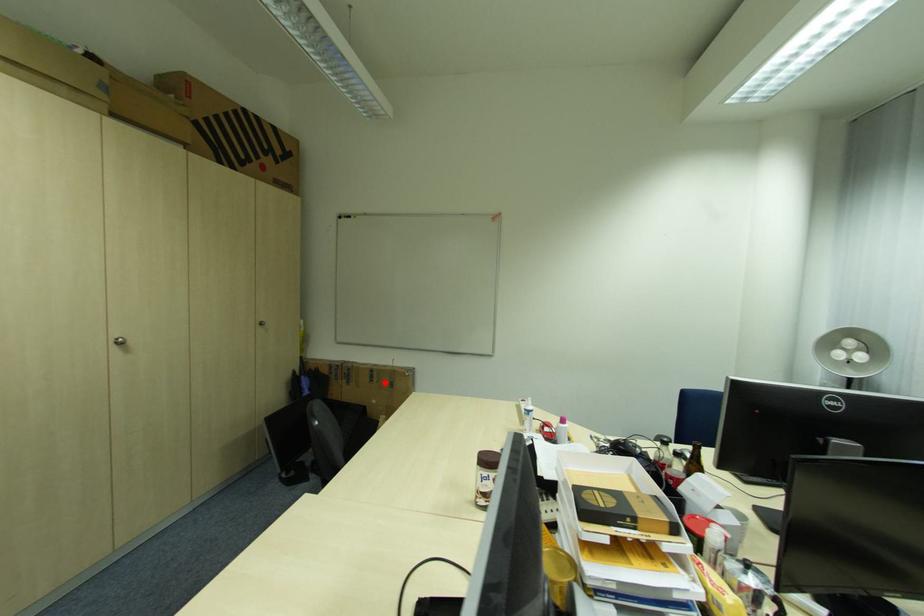
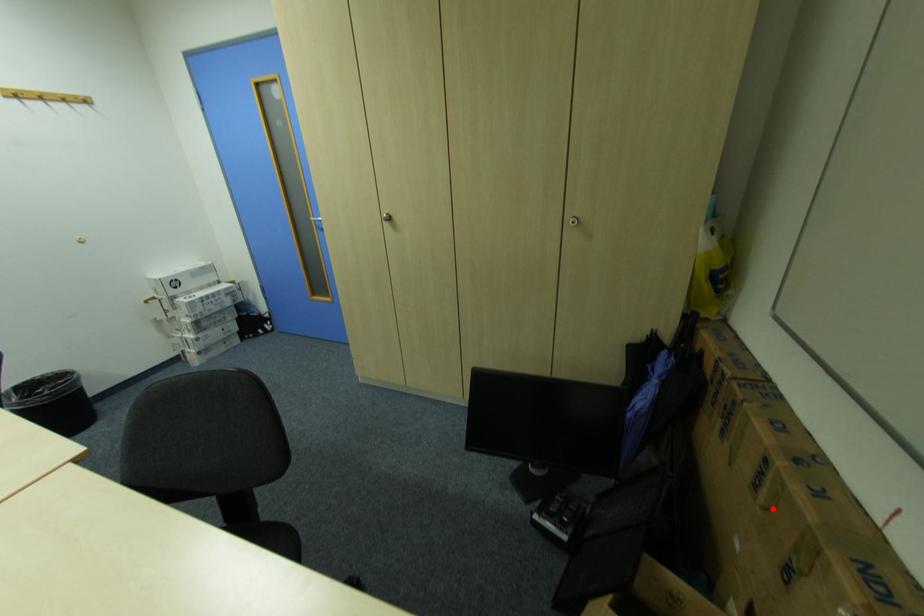
I am providing you with two images of the same scene from different viewpoints. A red point is marked on the first image and another point is marked on the second image. Is the red point in image1 aligned with the point shown in image2?

Yes